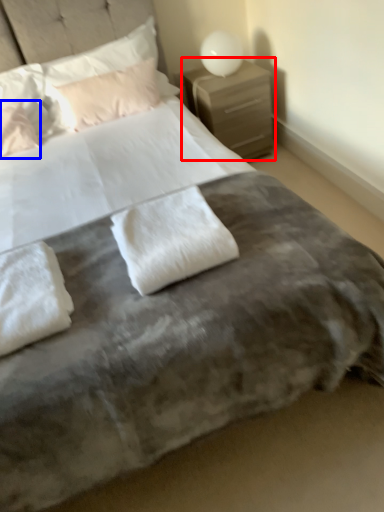
Question: Among these objects, which one is farthest to the camera, nightstand (highlighted by a red box) or pillow (highlighted by a blue box)?

Choices:
 (A) nightstand
 (B) pillow

Answer: (A)